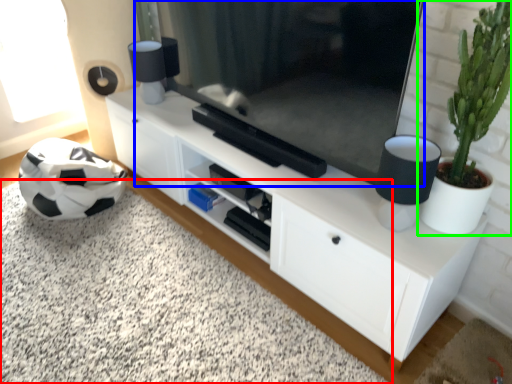
Question: Based on their relative distances, which object is farther from plain (highlighted by a red box)? Choose from television (highlighted by a blue box) and houseplant (highlighted by a green box).

Choices:
 (A) television
 (B) houseplant

Answer: (B)